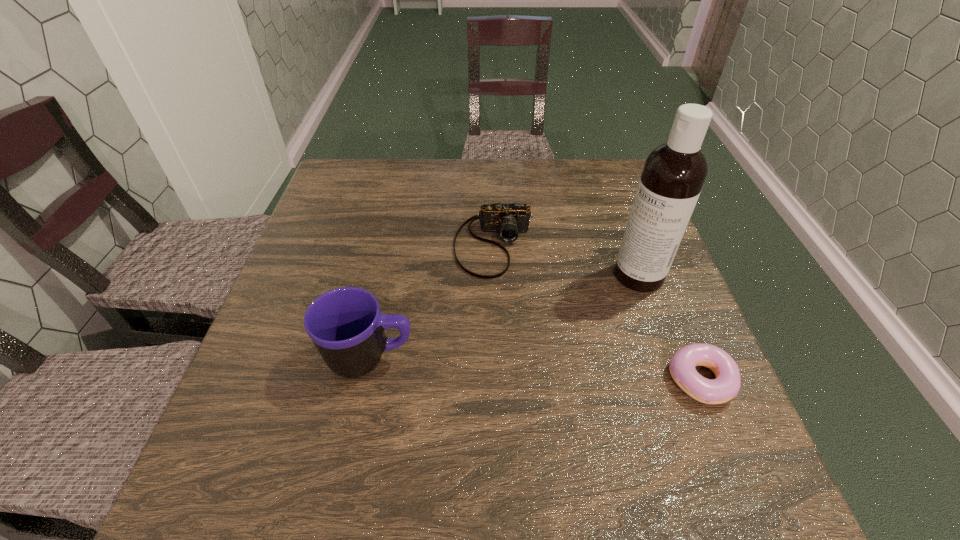
Where is `vacant space on the desktop that is between the mug and the doughnut and is positioned on the label side of the dishwasher detergent`? Image resolution: width=960 pixels, height=540 pixels. vacant space on the desktop that is between the mug and the doughnut and is positioned on the label side of the dishwasher detergent is located at coordinates (502, 367).

Find the location of a particular element. The height and width of the screenshot is (540, 960). free space on the desktop that is between the leftmost object and the doughnut and is positioned on the front-facing side of the third object from right to left is located at coordinates (492, 366).